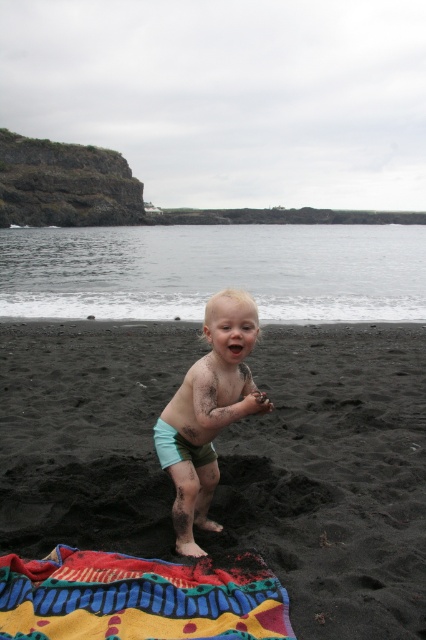
Question: Among these objects, which one is nearest to the camera?

Choices:
 (A) multicolored woven towel at lower left
 (B) black sand at center

Answer: (A)

Question: Does black sand at center appear on the left side of multicolored woven towel at lower left?

Choices:
 (A) yes
 (B) no

Answer: (B)

Question: Considering the relative positions of multicolored woven towel at lower left and dirty teal shorts at center in the image provided, where is multicolored woven towel at lower left located with respect to dirty teal shorts at center?

Choices:
 (A) above
 (B) below

Answer: (B)

Question: Estimate the real-world distances between objects in this image. Which object is closer to the multicolored woven towel at lower left?

Choices:
 (A) black sand at center
 (B) light blue fabric diaper at center
 (C) dirty teal shorts at center

Answer: (C)

Question: Which is farther from the light blue fabric diaper at center?

Choices:
 (A) black sand at center
 (B) dirty teal shorts at center
 (C) multicolored woven towel at lower left

Answer: (A)

Question: Is black sand at center thinner than light blue fabric diaper at center?

Choices:
 (A) no
 (B) yes

Answer: (A)